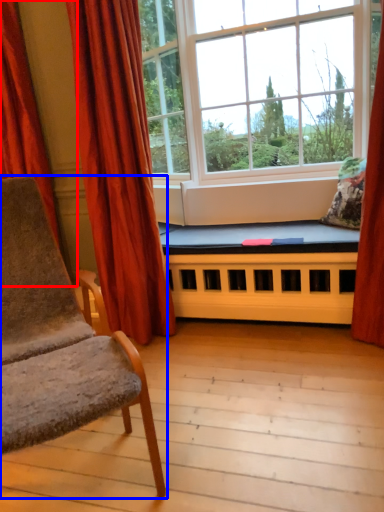
Question: Which of the following is the closest to the observer, curtain (highlighted by a red box) or chair (highlighted by a blue box)?

Choices:
 (A) curtain
 (B) chair

Answer: (B)